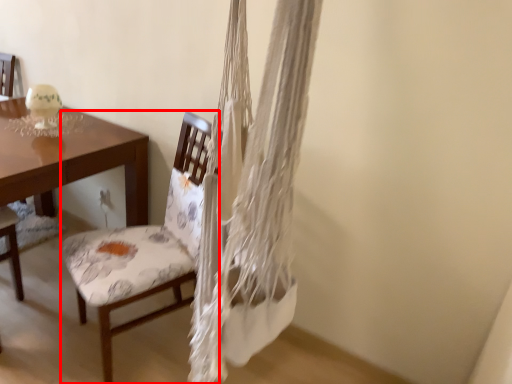
Question: From the image's perspective, what is the correct spatial relationship of chair (annotated by the red box) in relation to desk?

Choices:
 (A) above
 (B) below

Answer: (B)